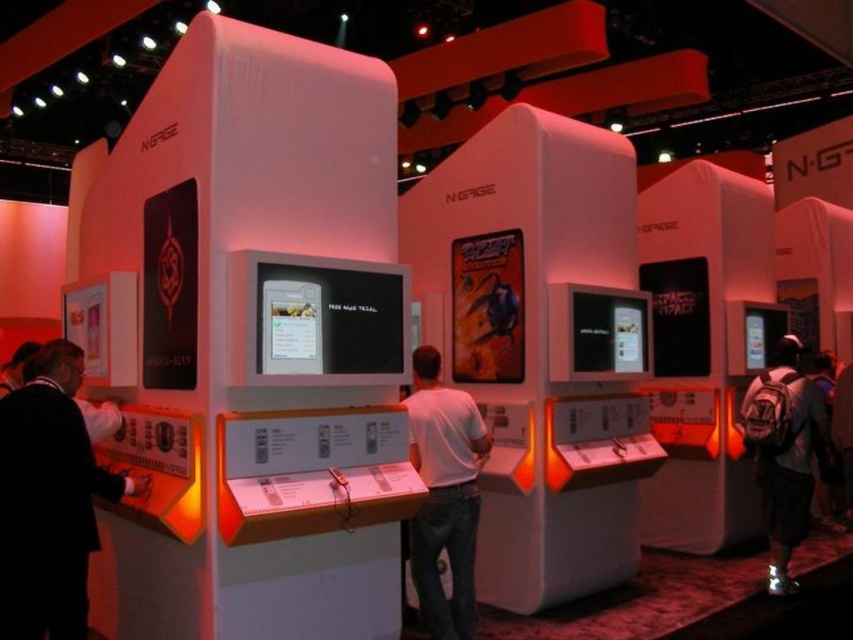
Does black matte suit at left appear on the left side of white matte shirt at center?

Yes, black matte suit at left is to the left of white matte shirt at center.

Which is in front, point (64, 384) or point (412, 433)?

Point (64, 384) is more forward.

Find the location of `black matte suit at left`. black matte suit at left is located at coordinates (49, 500).

From the picture: Does white matte shirt at center have a greater width compared to dark gray backpack at lower right?

No, white matte shirt at center is not wider than dark gray backpack at lower right.

Who is shorter, white matte shirt at center or dark gray backpack at lower right?

white matte shirt at center

Between point (459, 536) and point (801, 376), which one is positioned behind?

Point (801, 376)

You are a GUI agent. You are given a task and a screenshot of the screen. Output one action in this format:
    pyautogui.click(x=<x>, y=<y>)
    Task: Click on the white matte shirt at center
    Image resolution: width=853 pixels, height=640 pixels.
    Given the screenshot: What is the action you would take?
    pyautogui.click(x=444, y=493)

Which is more to the left, black matte suit at left or dark gray backpack at lower right?

Positioned to the left is black matte suit at left.

This screenshot has height=640, width=853. What do you see at coordinates (49, 500) in the screenshot?
I see `black matte suit at left` at bounding box center [49, 500].

Where is `black matte suit at left`? black matte suit at left is located at coordinates (49, 500).